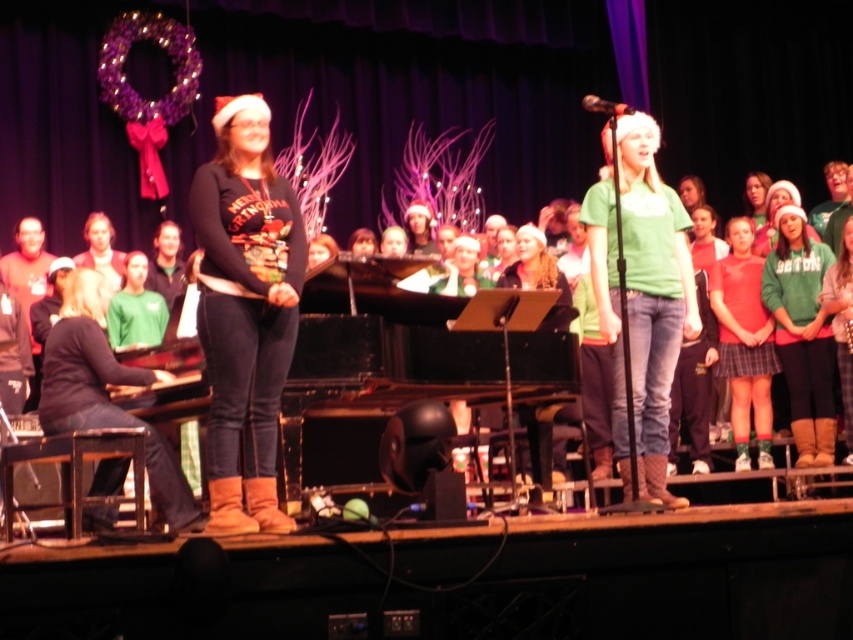
You are a stagehand preparing to adjust the lighting for the upcoming performance. You notice the matte black sweater at center and the green matte shirt at center. Which clothing item is closer to the stage floor?

The matte black sweater at center is positioned under the green matte shirt at center, so it is closer to the stage floor.

You are a costume designer preparing for a play. You have two costume pieces on stage, the matte black sweater at center and the green matte shirt at center. Which costume piece has a smaller width?

The matte black sweater at center has a smaller width than the green matte shirt at center.

You are a costume designer preparing for a play. You have two costumes on stage, the matte black sweater at center and the green matte shirt at center. Which costume is smaller in size?

The matte black sweater at center is smaller than the green matte shirt at center.